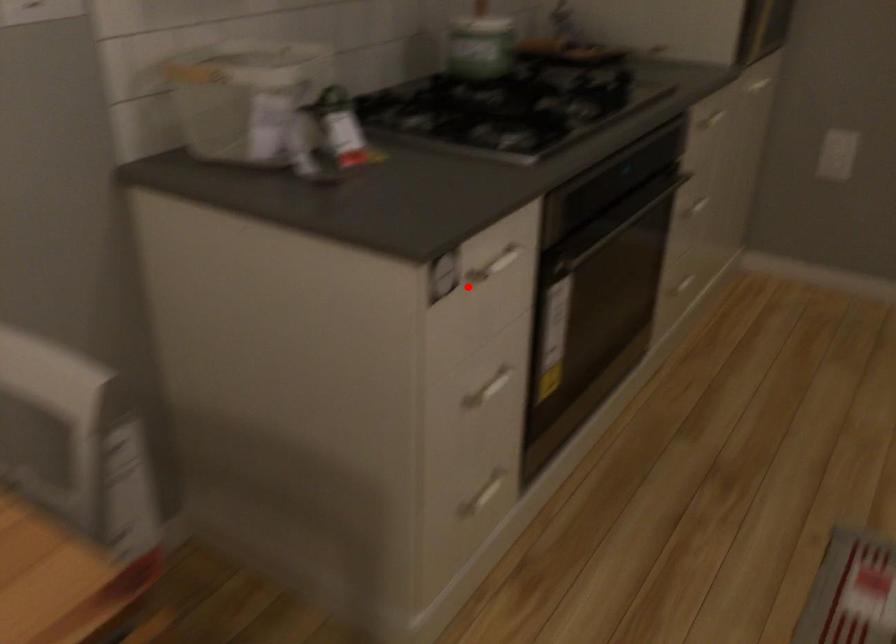
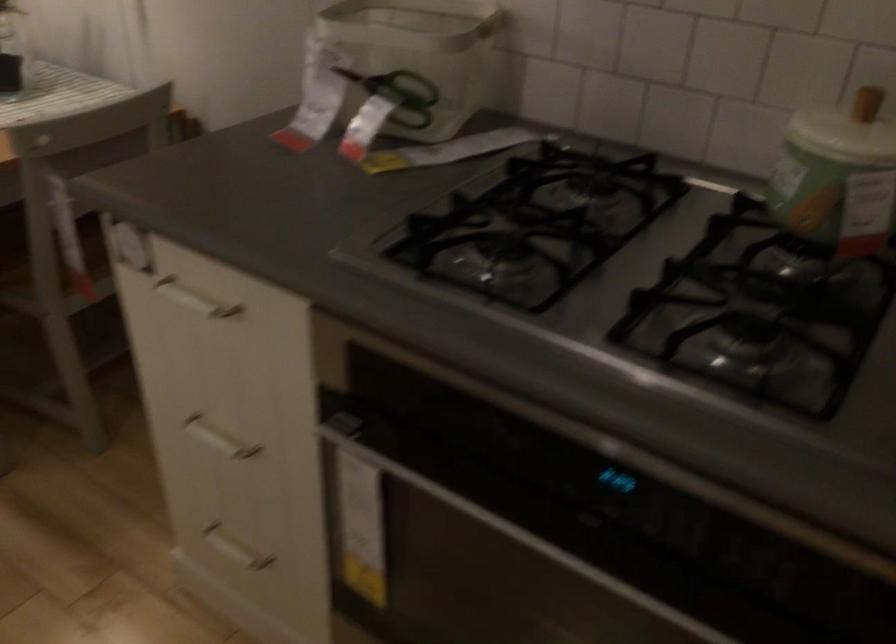
Question: A red point is marked in image1. In image2, is the corresponding 3D point closer to the camera or farther? Reply with the corresponding letter.

Choices:
 (A) The corresponding 3D point is closer.
 (B) The corresponding 3D point is farther.

Answer: (A)